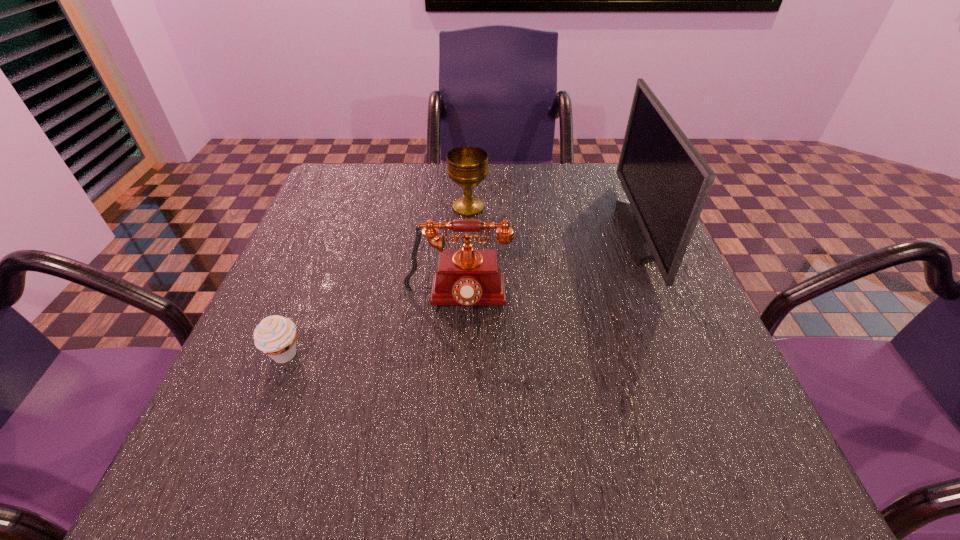
Image resolution: width=960 pixels, height=540 pixels. I want to click on free point at the right edge, so click(732, 368).

In the image, there is a desktop. At what (x,y) coordinates should I click in order to perform the action: click on free space at the far left corner. Please return your answer as a coordinate pair (x, y). This screenshot has width=960, height=540. Looking at the image, I should click on 340,192.

Where is `vacant space at the near left corner`? vacant space at the near left corner is located at coordinates click(x=189, y=496).

Where is `vacant space at the far right corner of the desktop`? The width and height of the screenshot is (960, 540). vacant space at the far right corner of the desktop is located at coordinates (593, 208).

This screenshot has width=960, height=540. In order to click on empty space between the third tallest object and the rightmost object in this screenshot , I will do `click(557, 220)`.

Locate an element on the screen. free space between the muffin and the chalice is located at coordinates (376, 281).

Image resolution: width=960 pixels, height=540 pixels. Identify the location of free spot between the muffin and the third shortest object. (371, 327).

The image size is (960, 540). What are the coordinates of `free point between the rightmost object and the second tallest object` in the screenshot? It's located at (551, 266).

Locate an element on the screen. This screenshot has height=540, width=960. vacant area that lies between the third shortest object and the shortest object is located at coordinates (371, 327).

Identify the location of the closest object to the tallest object. [467, 276].